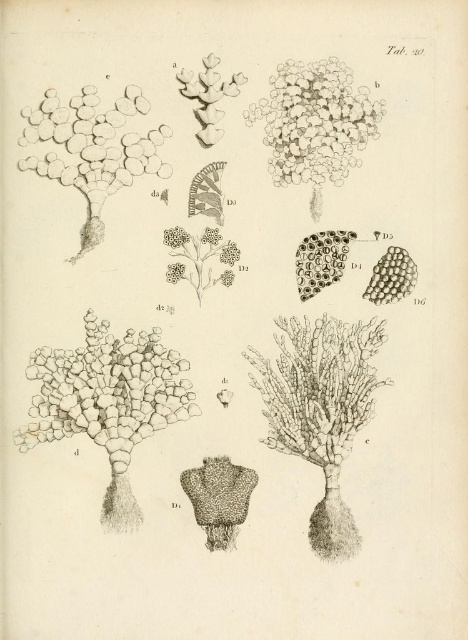
Is gray textured plant at center bigger than smooth white pebbles at upper left?

Correct, gray textured plant at center is larger in size than smooth white pebbles at upper left.

Is gray textured plant at center positioned behind smooth white pebbles at upper left?

No, it is in front of smooth white pebbles at upper left.

Is point (283, 317) less distant than point (95, 161)?

No.

The width and height of the screenshot is (468, 640). Find the location of `gray textured plant at center`. gray textured plant at center is located at coordinates (321, 410).

Between gray textured coral at lower left and smooth white pebbles at upper left, which one appears on the right side from the viewer's perspective?

gray textured coral at lower left

Is point (85, 417) positioned in front of point (57, 113)?

No, it is behind (57, 113).

Image resolution: width=468 pixels, height=640 pixels. What are the coordinates of `gray textured coral at lower left` in the screenshot? It's located at (107, 392).

At what (x,y) coordinates should I click in order to perform the action: click on gray textured coral at lower left. Please return your answer as a coordinate pair (x, y). Image resolution: width=468 pixels, height=640 pixels. Looking at the image, I should click on (107, 392).

Can you confirm if white textured cluster at upper center is thinner than smooth white pebbles at upper left?

Yes.

Which of these two, white textured cluster at upper center or smooth white pebbles at upper left, stands taller?

white textured cluster at upper center is taller.

Locate an element on the screen. white textured cluster at upper center is located at coordinates (314, 122).

The image size is (468, 640). I want to click on white textured cluster at upper center, so click(x=314, y=122).